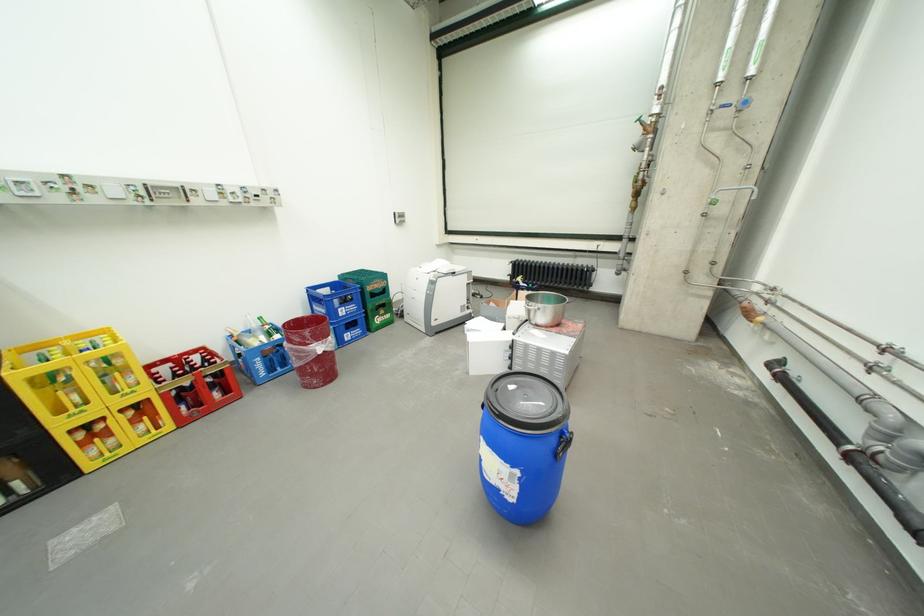
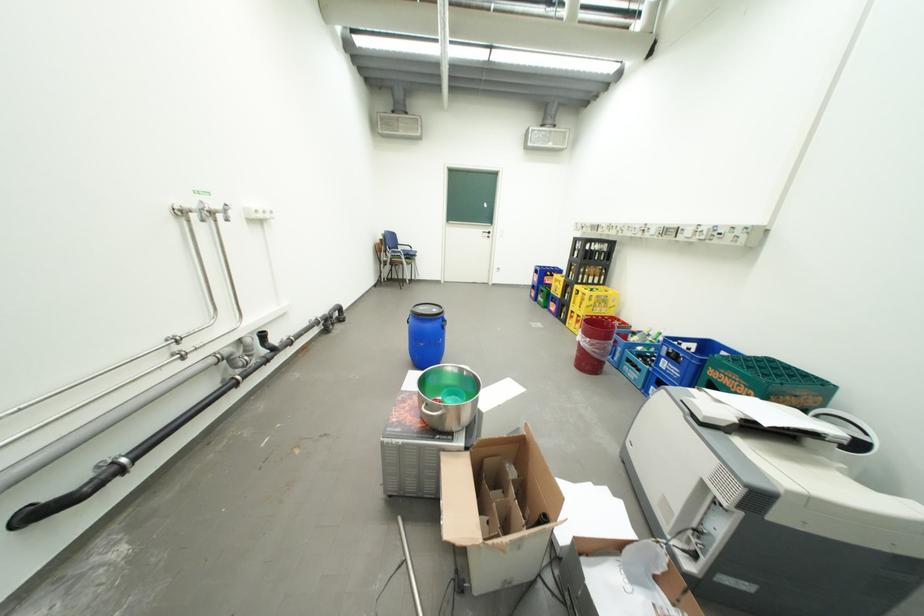
Where in the second image is the point corresponding to the point at 142,392 from the first image?

(590, 312)